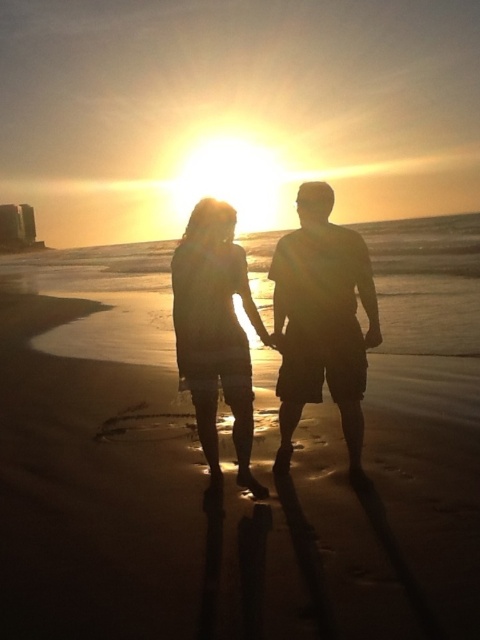
What are the coordinates of the sandy beach at center?

The sandy beach at center is located at coordinates point (232, 461).

You are a photographer trying to capture the sunset scene. You notice two figures in the foreground, one wearing silhouette shorts at center and the other in silhouette dress at center. Which clothing item appears bigger in your photo?

The silhouette shorts at center appears larger in size than the silhouette dress at center in the photo.

You are standing at the point marked by the coordinates point (232, 461), which is located at the sandy beach at center. If you walk straight ahead, will you eventually reach the silhouettes of two individuals in the foreground or the distant silhouette of the building?

The point (232, 461) is located at the sandy beach at center. Since the two individuals are in the foreground and the building is in the distance, walking straight ahead from the sandy beach at center would first lead you toward the silhouettes of the two individuals in the foreground before reaching the distant building.